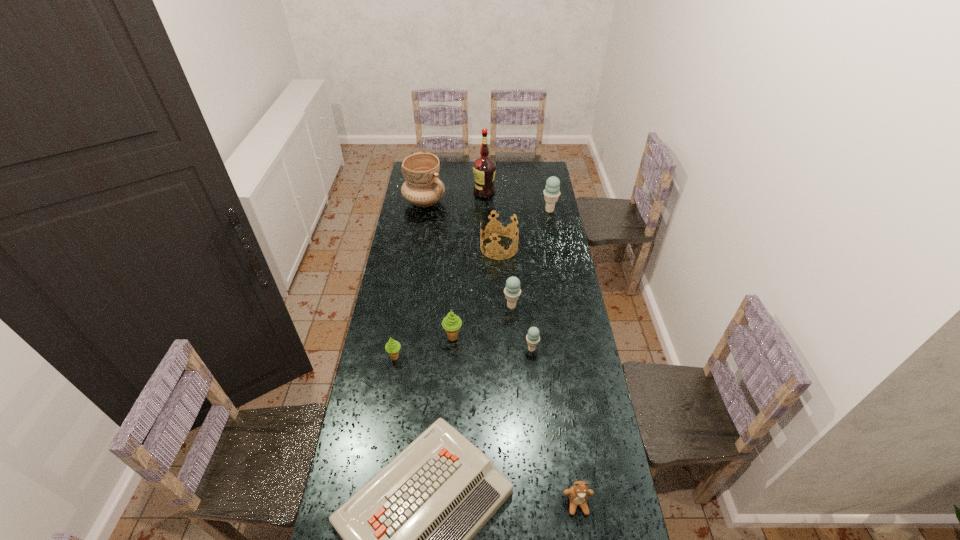
Identify the location of vacant space positioned on the front of the tallest icecream. The width and height of the screenshot is (960, 540). (559, 257).

At what (x,y) coordinates should I click in order to perform the action: click on free point located 0.400m on the right of the bigger green icecream. Please return your answer as a coordinate pair (x, y). Image resolution: width=960 pixels, height=540 pixels. Looking at the image, I should click on (560, 338).

In order to click on vacant position located on the left of the third icecream from right to left in this screenshot , I will do `click(430, 306)`.

Find the location of a particular element. vacant space situated on the front of the fourth farthest object is located at coordinates (500, 275).

In order to click on vacant region located 0.230m on the back of the second blue ice cream from right to left in this screenshot , I will do `click(527, 302)`.

Identify the location of free location located 0.290m on the front of the nearer green icecream. The width and height of the screenshot is (960, 540). (382, 434).

Identify the location of pottery situated at the left edge. This screenshot has width=960, height=540. (422, 187).

The width and height of the screenshot is (960, 540). Identify the location of icecream that is positioned at the left edge. point(392,347).

The width and height of the screenshot is (960, 540). I want to click on ice cream that is positioned at the right edge, so click(551, 193).

The height and width of the screenshot is (540, 960). I want to click on teddy bear situated at the right edge, so click(x=578, y=493).